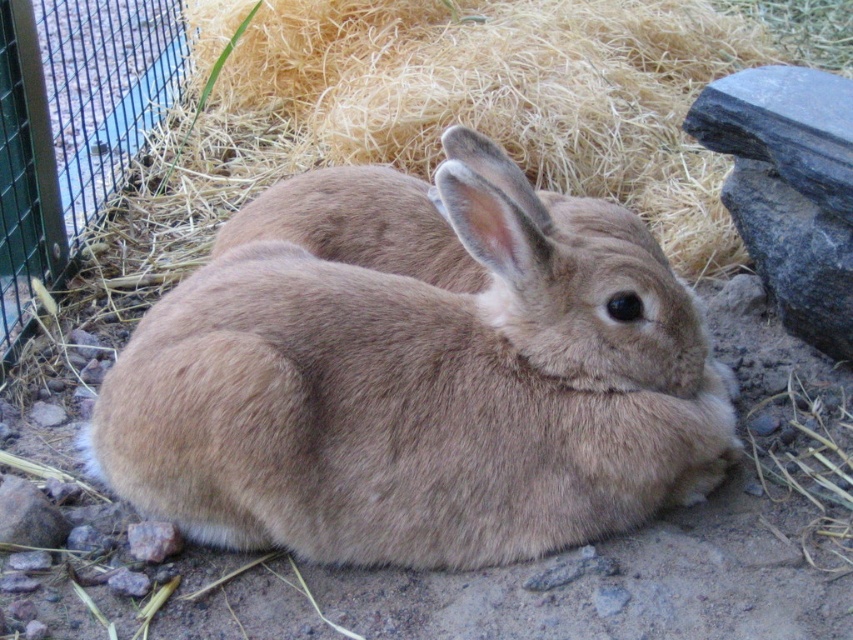
You are a farmer checking the rabbits in their enclosure. You notice the fuzzy brown rabbit at center and the brown soft hay at center. Which object is taller?

The brown soft hay at center is taller than the fuzzy brown rabbit at center.

You are a caretaker checking the rabbits in their enclosure. You notice the fuzzy brown rabbit at center and the brown soft hay at center. Which object is closer to you?

The fuzzy brown rabbit at center is closer to you since it is in front of the brown soft hay at center.

You are a caretaker checking the rabbits in their enclosure. You see the fuzzy brown rabbit at center and the brown soft hay at center. Which object is positioned to the right?

The brown soft hay at center is positioned to the right of the fuzzy brown rabbit at center.